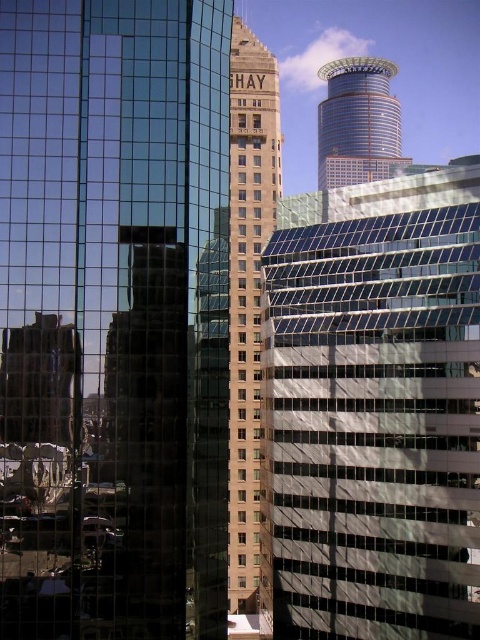
Question: Does reflective glass skyscraper at left have a greater width compared to glassy reflective building at center?

Choices:
 (A) no
 (B) yes

Answer: (A)

Question: Which object is closer to the camera taking this photo?

Choices:
 (A) shiny glass tower at upper center
 (B) beige stone building at center

Answer: (B)

Question: Which object is the closest to the reflective glass skyscraper at left?

Choices:
 (A) beige stone building at center
 (B) glassy reflective building at center
 (C) shiny glass tower at upper center

Answer: (A)

Question: Can you confirm if glassy reflective building at center is smaller than beige stone building at center?

Choices:
 (A) yes
 (B) no

Answer: (A)

Question: Which object appears farthest from the camera in this image?

Choices:
 (A) beige stone building at center
 (B) shiny glass tower at upper center

Answer: (B)

Question: Does reflective glass skyscraper at left have a larger size compared to glassy reflective building at center?

Choices:
 (A) no
 (B) yes

Answer: (A)